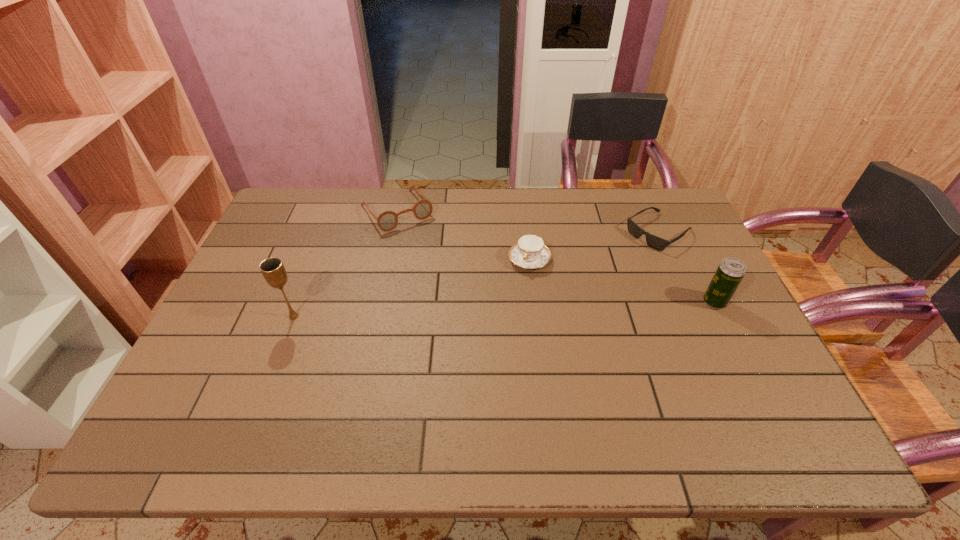
I want to click on free space that satisfies the following two spatial constraints: 1. on the back side of the beer can; 2. on the left side of the leftmost object, so click(300, 302).